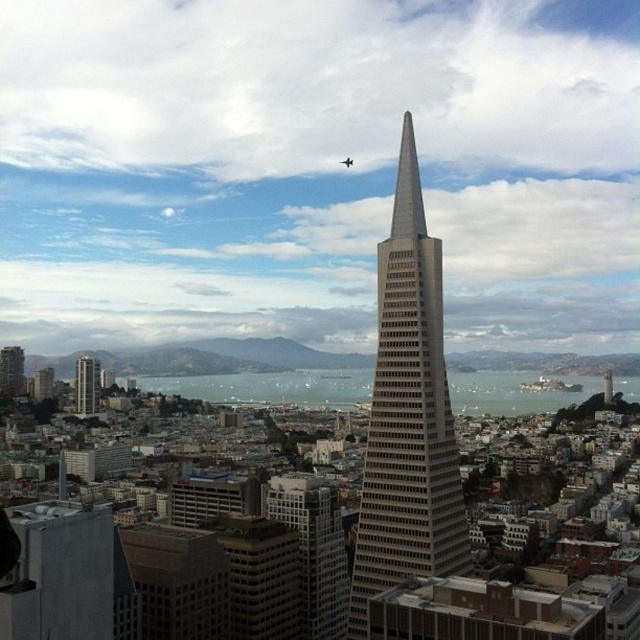
Does gray concrete building at left appear on the right side of matte gray building at left?

Indeed, gray concrete building at left is positioned on the right side of matte gray building at left.

Is point (92, 412) positioned after point (22, 376)?

No, (92, 412) is closer to viewer.

Where is `gray concrete building at left`? This screenshot has height=640, width=640. gray concrete building at left is located at coordinates (86, 385).

Between gray concrete skyscraper at center and gray concrete building at left, which one is positioned lower?

Positioned lower is gray concrete building at left.

Is point (435, 333) positioned behind point (83, 385)?

No, it is not.

Image resolution: width=640 pixels, height=640 pixels. Describe the element at coordinates (406, 416) in the screenshot. I see `gray concrete skyscraper at center` at that location.

Find the location of `gray concrete skyscraper at center`. gray concrete skyscraper at center is located at coordinates (406, 416).

Is gray concrete skyscraper at center positioned before matte gray building at left?

Yes, it is in front of matte gray building at left.

Is point (435, 376) positioned behind point (10, 388)?

No, (435, 376) is in front of (10, 388).

Locate an element on the screen. The image size is (640, 640). gray concrete skyscraper at center is located at coordinates (406, 416).

What are the coordinates of `gray concrete skyscraper at center` in the screenshot? It's located at (406, 416).